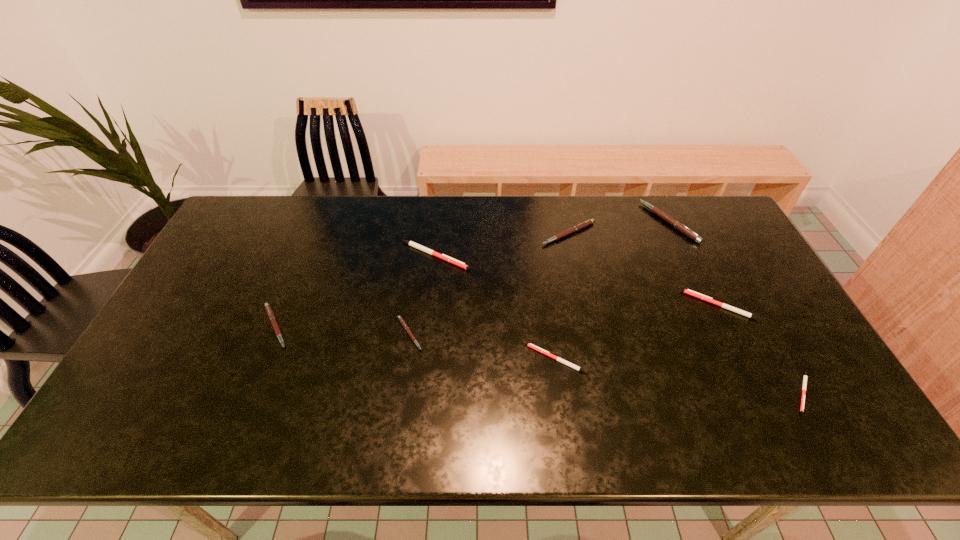
Find the location of a particular element. This screenshot has height=540, width=960. free region located 0.100m on the clicker of the second farthest white pen is located at coordinates (652, 306).

This screenshot has width=960, height=540. Find the location of `vacant point located at the nib of the smallest pink pen`. vacant point located at the nib of the smallest pink pen is located at coordinates (500, 334).

Where is `vacant space located on the clicker of the second smallest white pen`? Image resolution: width=960 pixels, height=540 pixels. vacant space located on the clicker of the second smallest white pen is located at coordinates (384, 359).

Identify the location of free spot located 0.110m on the clicker of the second smallest white pen. (484, 359).

At what (x,y) coordinates should I click in order to perform the action: click on vacant area situated 0.200m on the clicker of the second smallest white pen. Please return your answer as a coordinate pair (x, y). This screenshot has width=960, height=540. Looking at the image, I should click on (449, 359).

Find the location of `vacant space positioned on the clicker of the shortest object`. vacant space positioned on the clicker of the shortest object is located at coordinates (827, 435).

I want to click on object located at the near edge, so click(x=805, y=375).

Image resolution: width=960 pixels, height=540 pixels. What are the coordinates of `object located in the far right corner section of the desktop` in the screenshot? It's located at (682, 228).

Identify the location of object that is positioned at the near right corner. This screenshot has width=960, height=540. (805, 375).

Find the location of a particular element. free space at the far edge of the desktop is located at coordinates (356, 199).